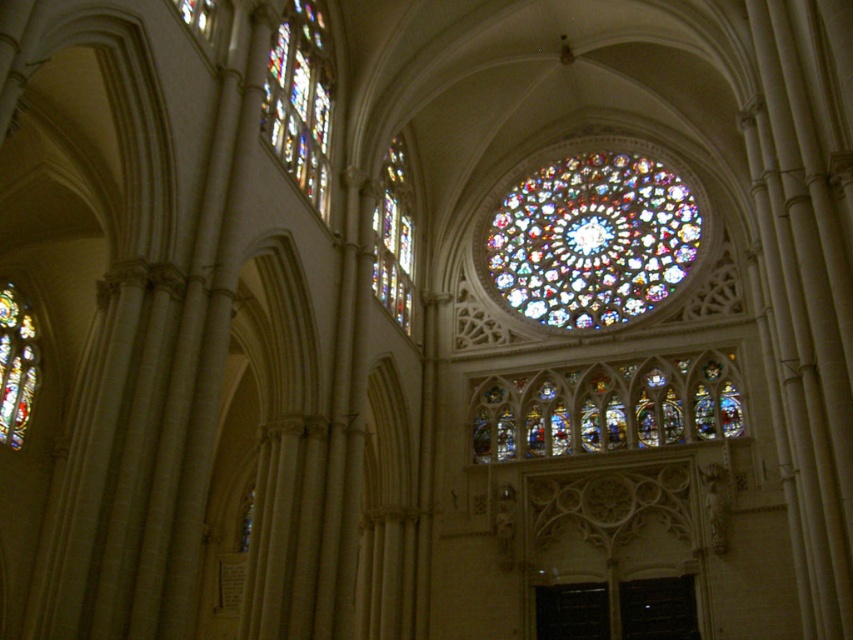
You are an architect analyzing the cathedral. Which of the two stained glass pieces, the multicolored stained glass at upper center or the stained glass window at left, is taller?

The multicolored stained glass at upper center is taller than the stained glass window at left.

You are standing inside the cathedral and looking up. You see the multicolored stained glass at upper center and the clear glass window at upper left. Which one is more to the right?

The multicolored stained glass at upper center is more to the right because it is positioned on the right side of the clear glass window at upper left.

You are an architect analyzing the cathedral design. From your vantage point on the ground, which object is positioned higher up between the multicolored stained glass at upper center and the clear glass window at upper left?

The clear glass window at upper left is positioned higher up than the multicolored stained glass at upper center because the multicolored stained glass at upper center is located below it.